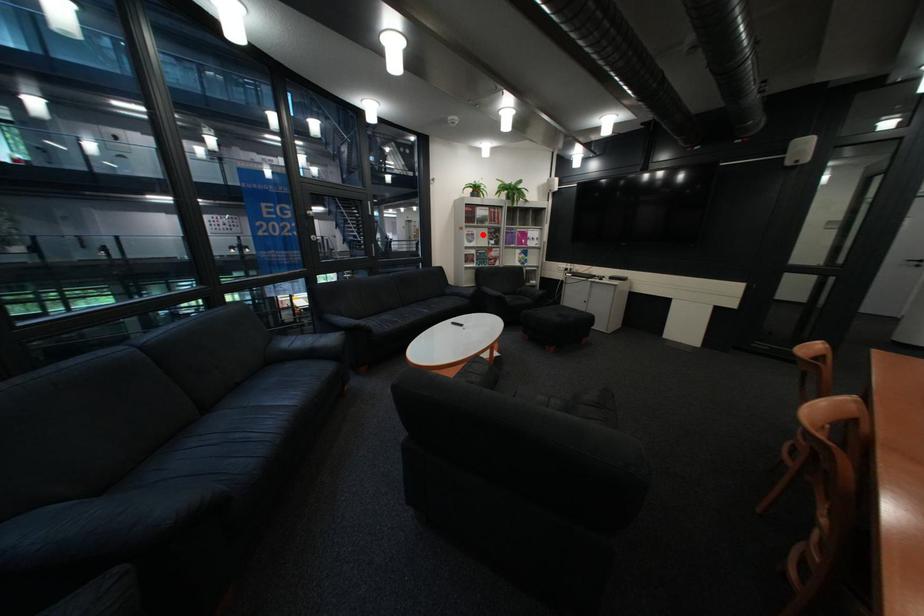
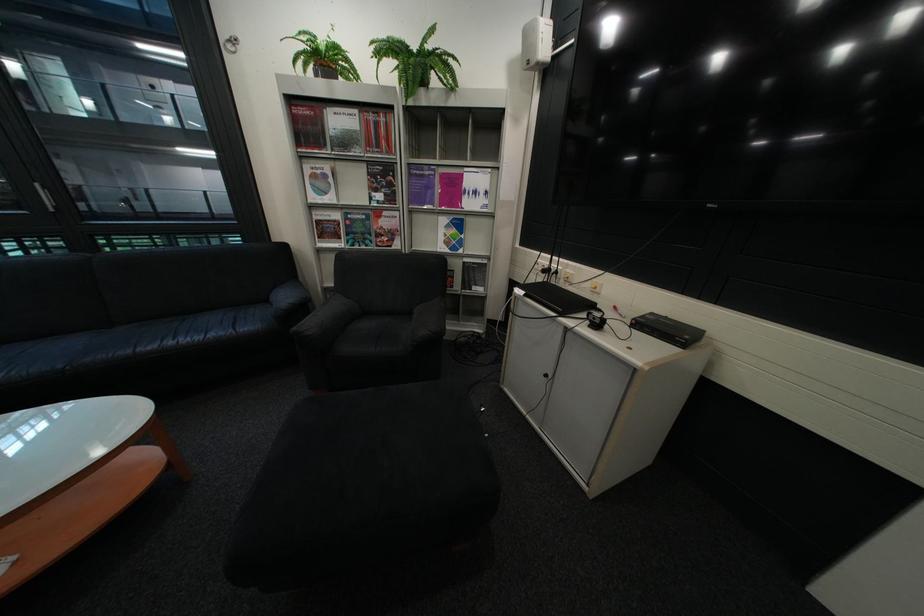
Locate, in the second image, the point that corresponds to the highlighted location in the first image.

(329, 177)